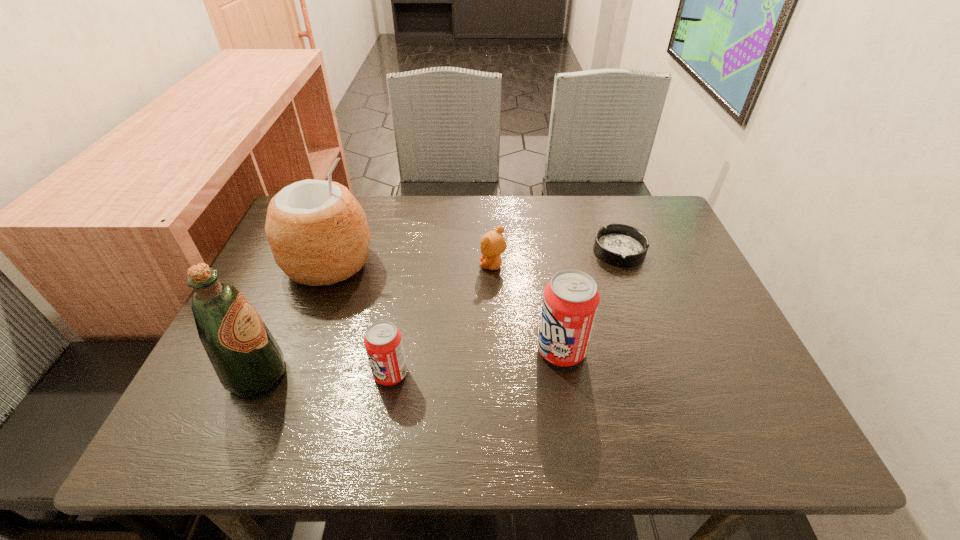
Locate an element on the screen. vacant area situated on the front-facing side of the olive oil is located at coordinates (385, 375).

The image size is (960, 540). Find the location of `coconut present at the far edge`. coconut present at the far edge is located at coordinates (318, 232).

Find the location of a particular element. ashtray situated at the far edge is located at coordinates (622, 245).

This screenshot has height=540, width=960. I want to click on olive oil at the near edge, so click(x=247, y=359).

Identify the location of coconut positioned at the left edge. The image size is (960, 540). (318, 232).

You are a GUI agent. You are given a task and a screenshot of the screen. Output one action in this format:
    pyautogui.click(x=<x>, y=<y>)
    Task: Click on the olive oil that is at the left edge
    
    Given the screenshot: What is the action you would take?
    pyautogui.click(x=247, y=359)

The height and width of the screenshot is (540, 960). What are the coordinates of `object that is positioned at the right edge` in the screenshot? It's located at (622, 245).

At what (x,y) coordinates should I click in order to perform the action: click on object present at the far left corner. Please return your answer as a coordinate pair (x, y). Looking at the image, I should click on (318, 232).

Find the location of a particular element. The height and width of the screenshot is (540, 960). object that is at the near left corner is located at coordinates (247, 359).

The image size is (960, 540). In order to click on object that is at the far right corner in this screenshot , I will do `click(622, 245)`.